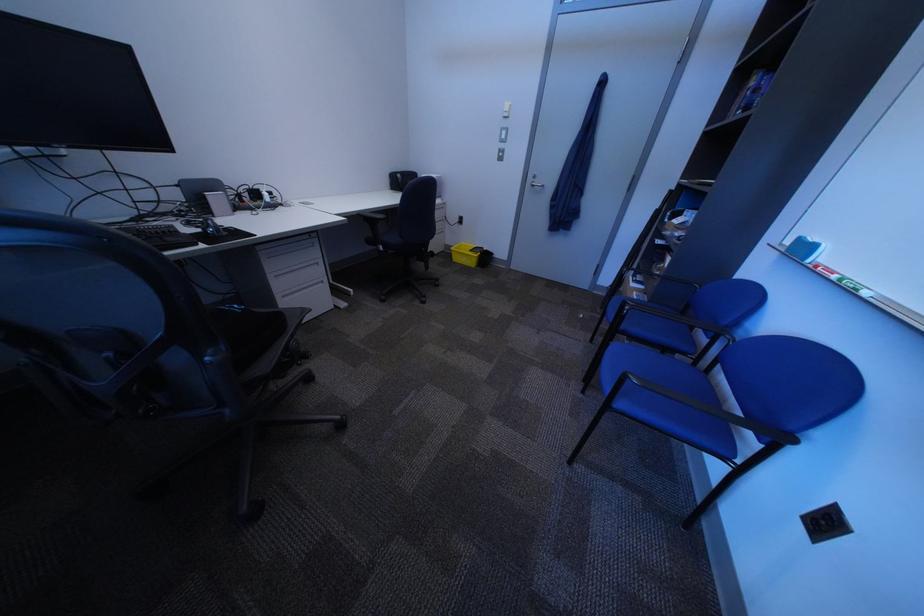
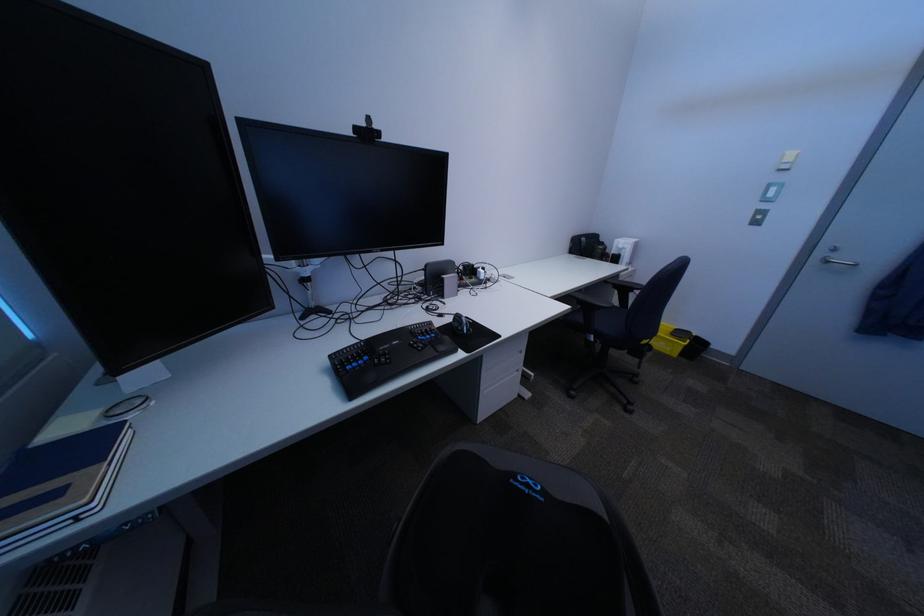
Question: The camera is either moving clockwise (left) or counter-clockwise (right) around the object. The first image is from the beginning of the video and the second image is from the end. Is the camera moving left or right when shooting the video?

Choices:
 (A) Left
 (B) Right

Answer: (B)